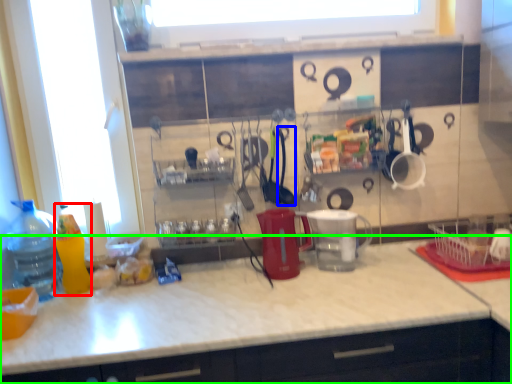
Question: Which is nearer to the bottle (highlighted by a red box)? tableware (highlighted by a blue box) or countertop (highlighted by a green box).

Choices:
 (A) tableware
 (B) countertop

Answer: (B)